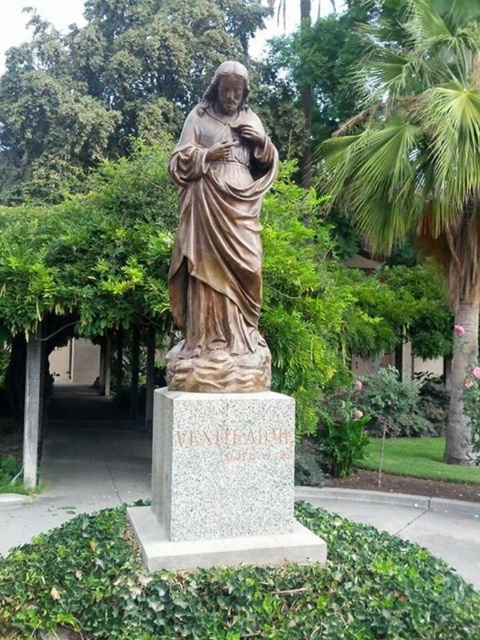
Is point (432, 108) closer to camera compared to point (238, 253)?

No, (432, 108) is behind (238, 253).

Can you confirm if green leafy palm tree at center right is shorter than bronze statue at center?

No, green leafy palm tree at center right is not shorter than bronze statue at center.

Does point (358, 189) come farther from viewer compared to point (197, 320)?

Yes.

Locate an element on the screen. This screenshot has width=480, height=640. green leafy palm tree at center right is located at coordinates (420, 163).